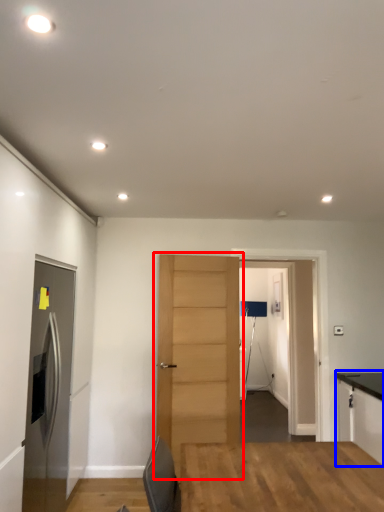
Question: Among these objects, which one is farthest to the camera, door (highlighted by a red box) or cabinetry (highlighted by a blue box)?

Choices:
 (A) door
 (B) cabinetry

Answer: (A)